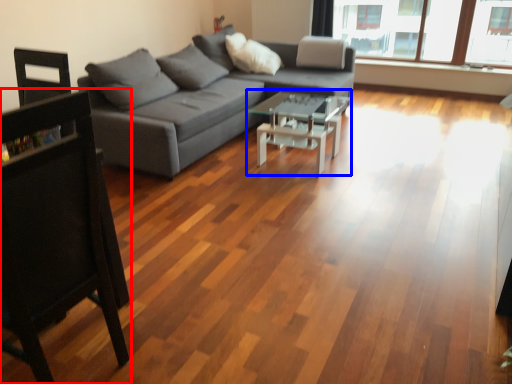
Question: Which object is closer to the camera taking this photo, chair (highlighted by a red box) or coffee table (highlighted by a blue box)?

Choices:
 (A) chair
 (B) coffee table

Answer: (A)